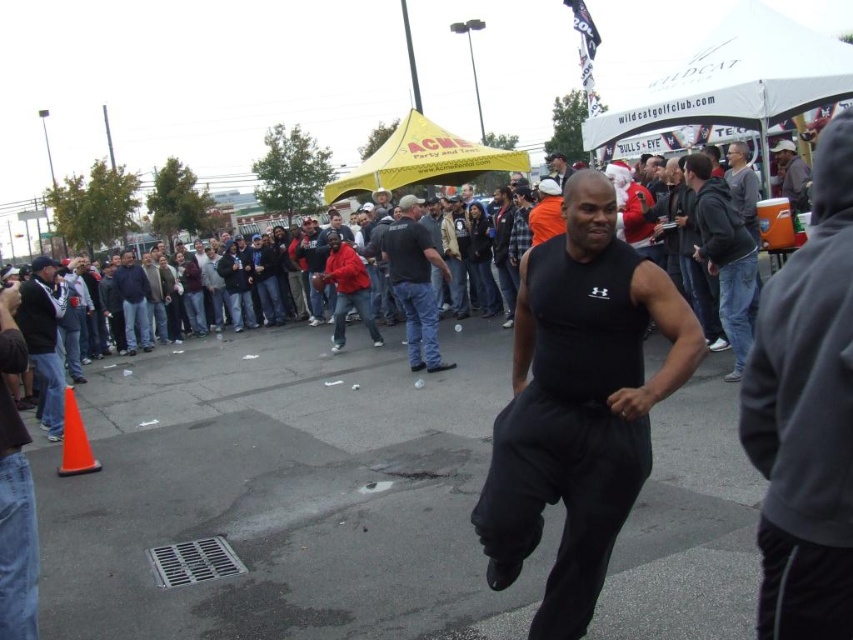
Is black sleeveless shirt at center wider than black cotton shirt at center?

In fact, black sleeveless shirt at center might be narrower than black cotton shirt at center.

Can you confirm if black sleeveless shirt at center is positioned above black cotton shirt at center?

Correct, black sleeveless shirt at center is located above black cotton shirt at center.

Locate an element on the screen. The height and width of the screenshot is (640, 853). black sleeveless shirt at center is located at coordinates (724, 256).

Looking at this image, does dark gray hoodie at upper right have a greater height compared to matte black tank top at center?

No.

Is point (802, 166) closer to camera compared to point (560, 172)?

That is True.

Image resolution: width=853 pixels, height=640 pixels. In order to click on dark gray hoodie at upper right in this screenshot , I will do `click(791, 173)`.

Who is taller, black sleeveless shirt at center or orange matte traffic cone at lower left?

black sleeveless shirt at center is taller.

Is black sleeveless shirt at center below orange matte traffic cone at lower left?

Incorrect, black sleeveless shirt at center is not positioned below orange matte traffic cone at lower left.

At what (x,y) coordinates should I click in order to perform the action: click on black sleeveless shirt at center. Please return your answer as a coordinate pair (x, y). Looking at the image, I should click on (724, 256).